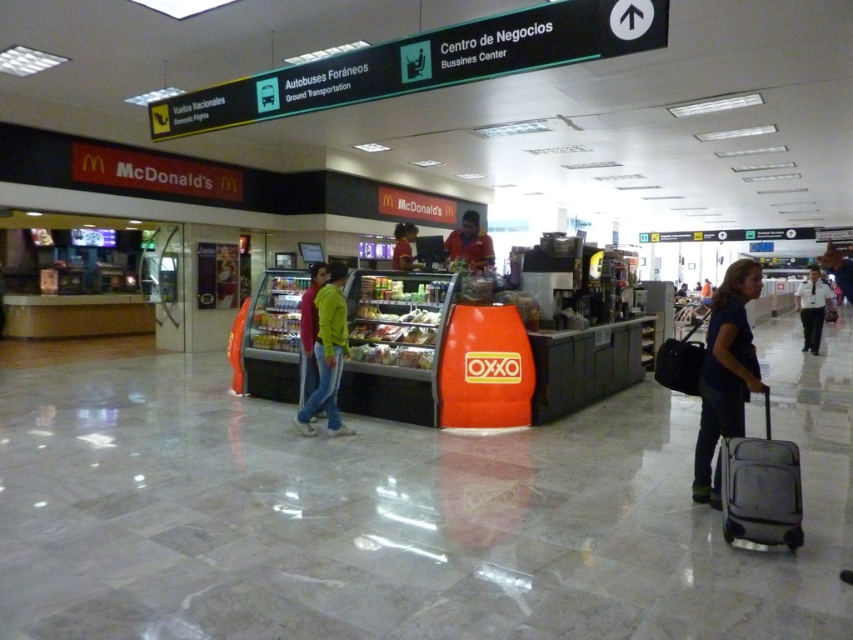
Question: Can you confirm if black fabric suitcase at center is wider than matte yellow shirt at center?

Choices:
 (A) yes
 (B) no

Answer: (A)

Question: Which object appears farthest from the camera in this image?

Choices:
 (A) jeans at center
 (B) black fabric suitcase at center

Answer: (A)

Question: Is gray fabric suitcase at lower right to the left of black fabric suitcase at center from the viewer's perspective?

Choices:
 (A) yes
 (B) no

Answer: (A)

Question: Which object appears closest to the camera in this image?

Choices:
 (A) dark blue fabric at center-right
 (B) gray fabric suitcase at lower right

Answer: (B)

Question: Is jeans at center to the left of black fabric suitcase at center from the viewer's perspective?

Choices:
 (A) no
 (B) yes

Answer: (B)

Question: Which point is closer to the camera?

Choices:
 (A) (401, 237)
 (B) (709, 296)
 (C) (693, 385)
 (D) (815, 346)

Answer: (C)